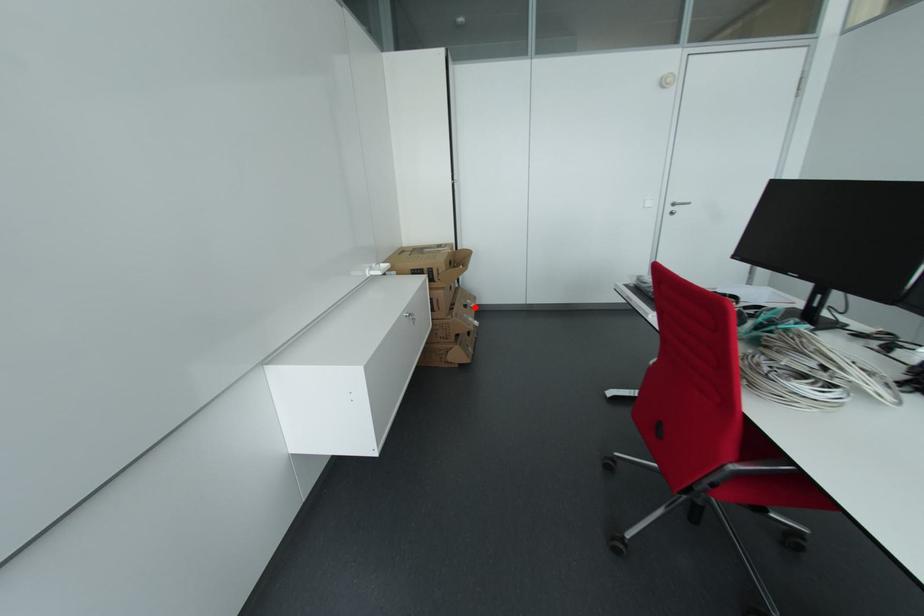
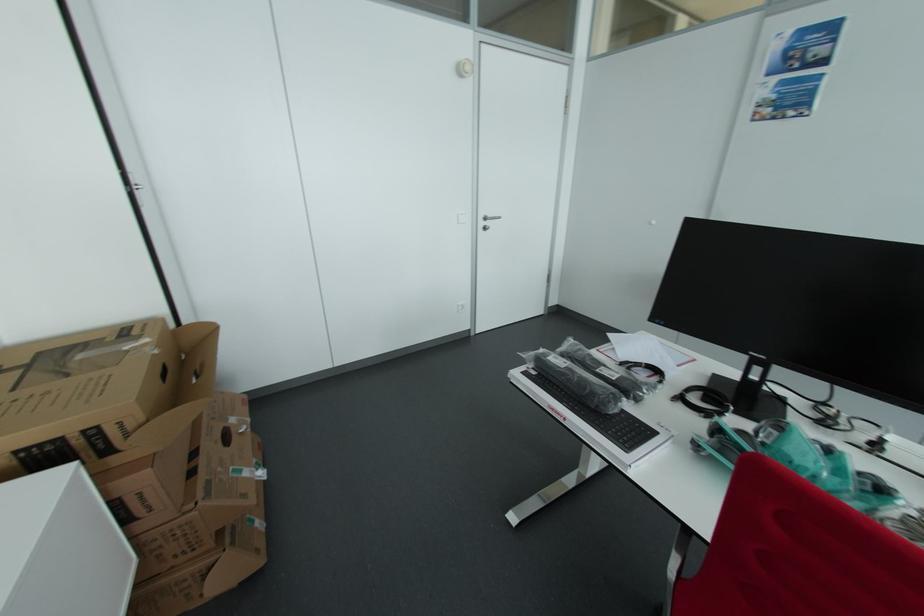
Question: I am providing you with two images of the same scene from different viewpoints. A red point is marked on the first image. Can you still see the location of the red point in image 2?

Choices:
 (A) Yes
 (B) No

Answer: (A)